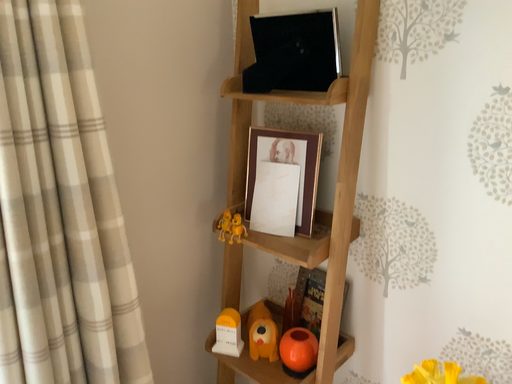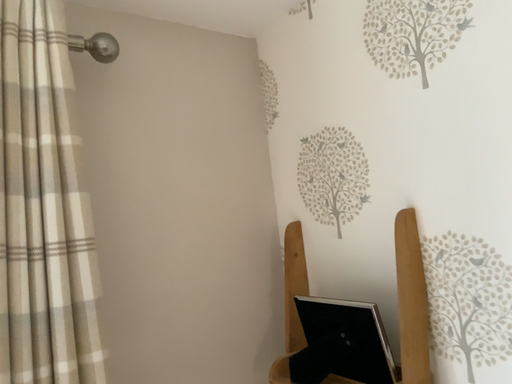
Question: Which way did the camera rotate in the video?

Choices:
 (A) rotated right
 (B) rotated left

Answer: (B)